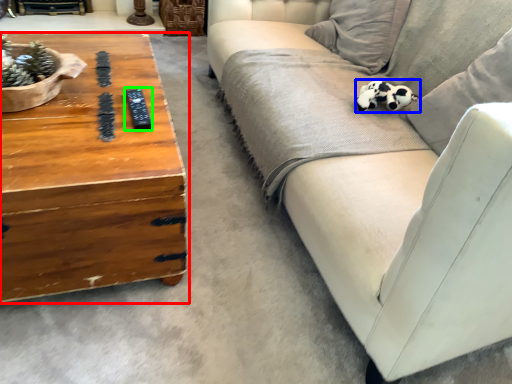
Question: Estimate the real-world distances between objects in this image. Which object is farther from coffee table (highlighted by a red box), animal (highlighted by a blue box) or remote (highlighted by a green box)?

Choices:
 (A) animal
 (B) remote

Answer: (A)